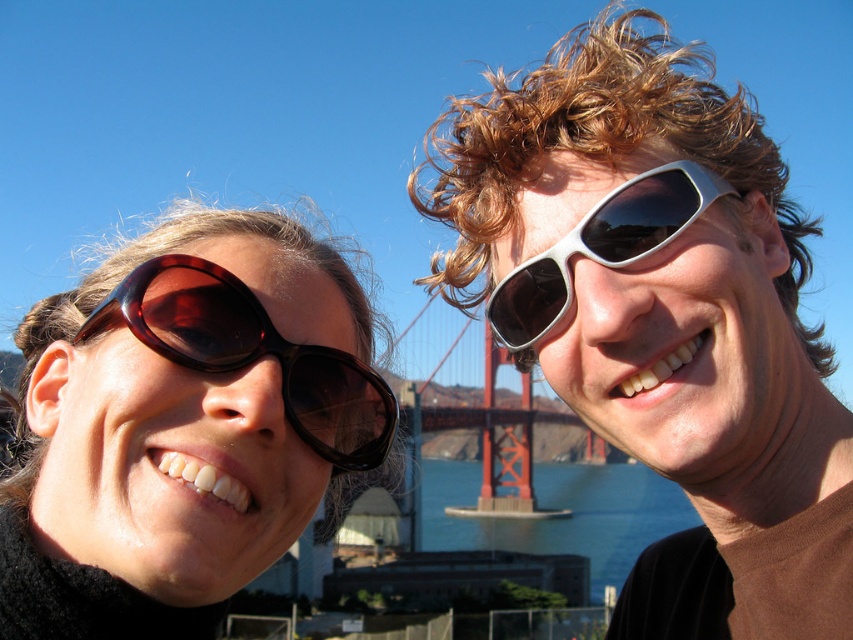
You are a photographer trying to capture a closeup of the tortoiseshell sunglasses at upper left and the brown glossy sunglasses at left. Based on their positions, which pair is closer to the bottom of the photo?

The tortoiseshell sunglasses at upper left is located below brown glossy sunglasses at left, so it is closer to the bottom of the photo.

You are a photographer trying to capture a wide shot of the scene. The tortoiseshell sunglasses at upper left and the blue water at center are important elements. Given their distance apart, do you think you can fit both into a single frame without zooming in? Please explain using the distance provided.

The tortoiseshell sunglasses at upper left and blue water at center are 111.51 meters apart from each other. Since this distance is quite large, it might be challenging to fit both into a single frame without zooming out further or adjusting your position to ensure both elements are visible.